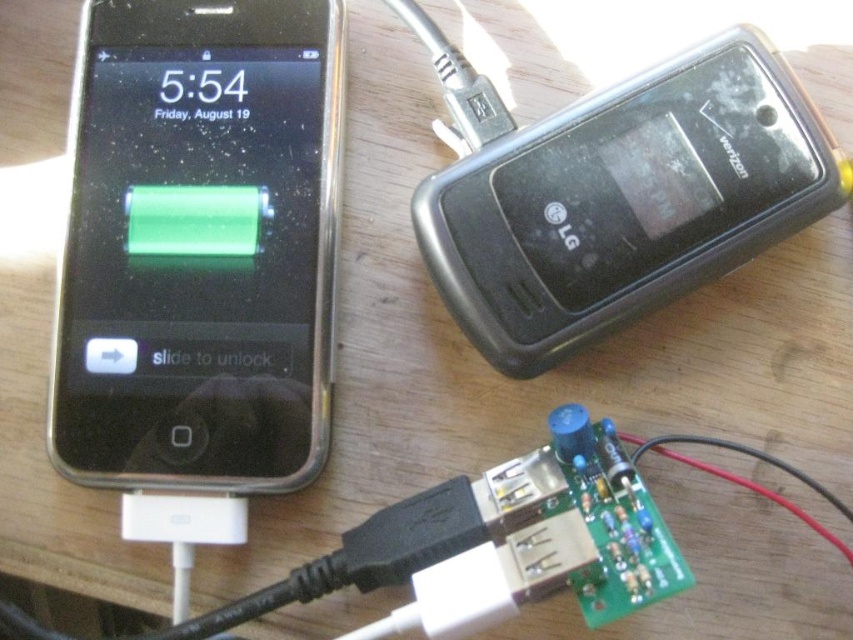
Question: Among these points, which one is nearest to the camera?

Choices:
 (A) (102, 472)
 (B) (732, 161)

Answer: (A)

Question: Does black glossy smartphone at left have a greater width compared to black plastic lg phone at upper right?

Choices:
 (A) no
 (B) yes

Answer: (A)

Question: Can you confirm if black glossy smartphone at left is bigger than black plastic lg phone at upper right?

Choices:
 (A) no
 (B) yes

Answer: (A)

Question: In this image, where is black glossy smartphone at left located relative to black plastic lg phone at upper right?

Choices:
 (A) left
 (B) right

Answer: (A)